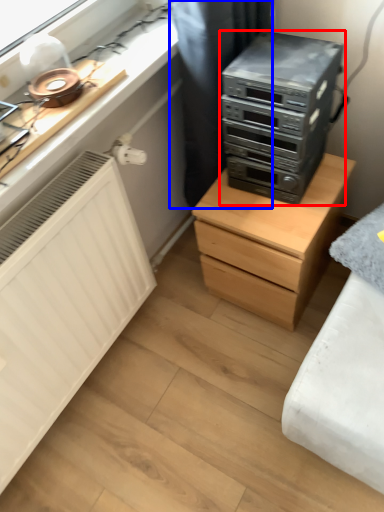
Question: Which of the following is the farthest to the observer, home appliance (highlighted by a red box) or curtain (highlighted by a blue box)?

Choices:
 (A) home appliance
 (B) curtain

Answer: (B)